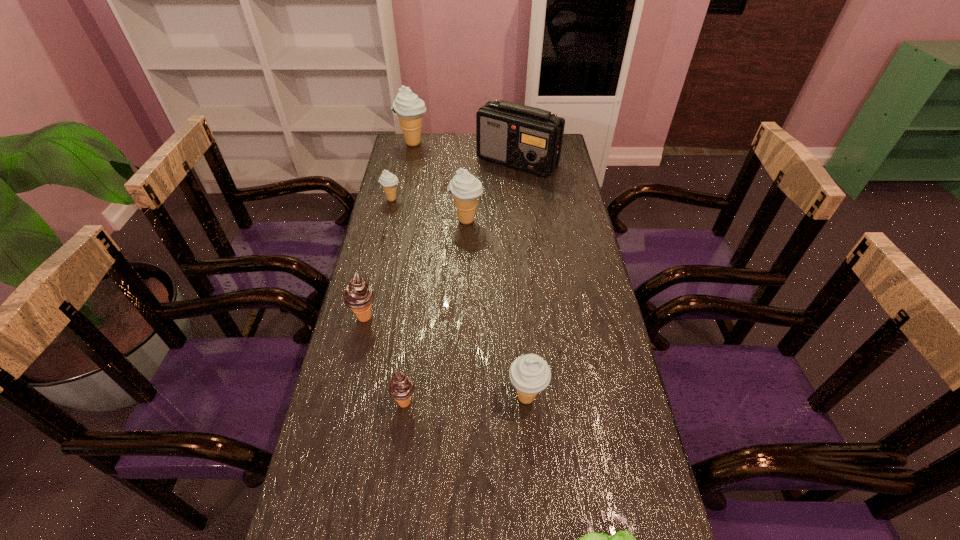
Where is `the third farthest object`? Image resolution: width=960 pixels, height=540 pixels. the third farthest object is located at coordinates (389, 181).

This screenshot has height=540, width=960. What are the coordinates of `the right chocolate icecream` in the screenshot? It's located at (401, 387).

Find the location of a particular element. The width and height of the screenshot is (960, 540). the fourth icecream from left to right is located at coordinates (401, 387).

The width and height of the screenshot is (960, 540). In order to click on blank area located on the right of the farthest beige icecream in this screenshot , I will do (x=454, y=143).

This screenshot has width=960, height=540. In order to click on vacant space located 0.330m on the front panel of the radio receiver in this screenshot , I will do `click(525, 233)`.

Identify the location of vacant space located 0.300m on the front of the second icecream from right to left. The image size is (960, 540). (464, 296).

I want to click on vacant space situated 0.060m on the back of the rightmost icecream, so click(x=523, y=360).

Image resolution: width=960 pixels, height=540 pixels. I want to click on free space located 0.150m on the back of the bigger chocolate icecream, so click(x=376, y=270).

At what (x,y) coordinates should I click in order to perform the action: click on vacant region located 0.180m on the front of the fifth nearest icecream. Please return your answer as a coordinate pair (x, y). Looking at the image, I should click on (383, 237).

Where is `free location located on the right of the fifth object from right to left`? This screenshot has height=540, width=960. free location located on the right of the fifth object from right to left is located at coordinates (507, 402).